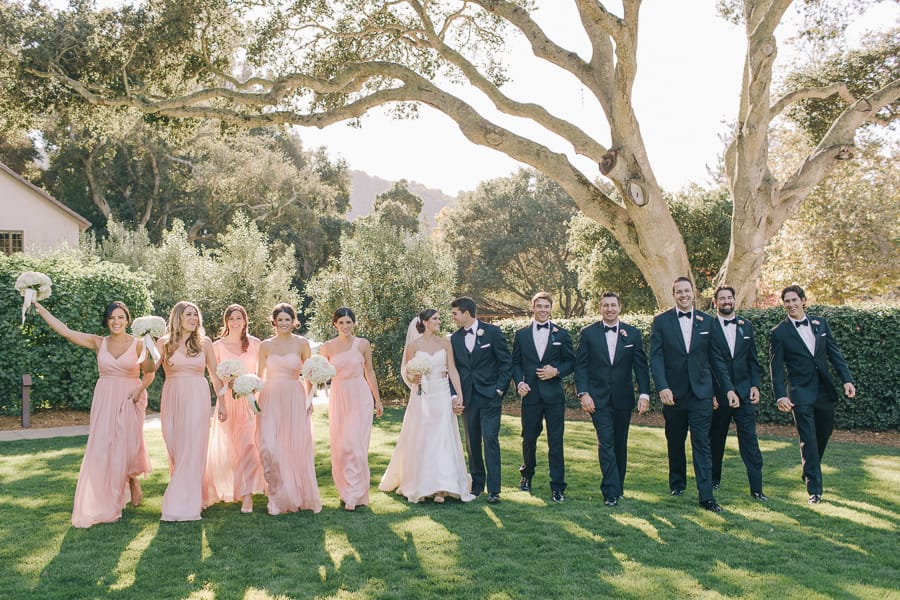
This screenshot has width=900, height=600. I want to click on flower bouquets, so click(x=31, y=286), click(x=142, y=321), click(x=230, y=369), click(x=248, y=381), click(x=317, y=367), click(x=419, y=364).